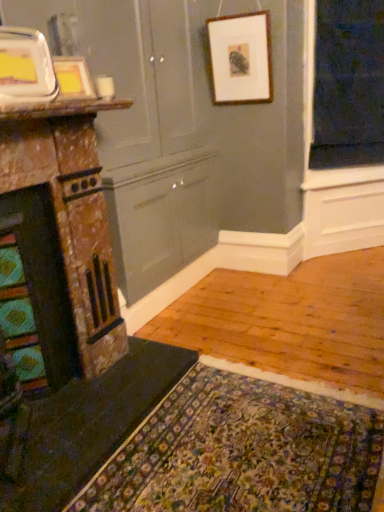
Question: Is the surface of white marble countertop at upper left in direct contact with black fabric at upper right?

Choices:
 (A) yes
 (B) no

Answer: (B)

Question: Does white marble countertop at upper left come in front of black fabric at upper right?

Choices:
 (A) no
 (B) yes

Answer: (B)

Question: Is white marble countertop at upper left smaller than black fabric at upper right?

Choices:
 (A) no
 (B) yes

Answer: (B)

Question: Can you confirm if white marble countertop at upper left is taller than black fabric at upper right?

Choices:
 (A) no
 (B) yes

Answer: (A)

Question: Is white marble countertop at upper left far from black fabric at upper right?

Choices:
 (A) yes
 (B) no

Answer: (A)

Question: Is white marble countertop at upper left positioned beyond the bounds of black fabric at upper right?

Choices:
 (A) no
 (B) yes

Answer: (B)

Question: Is dark green felt doormat at lower left to the left of black fabric at upper right from the viewer's perspective?

Choices:
 (A) no
 (B) yes

Answer: (B)

Question: Is dark green felt doormat at lower left looking in the opposite direction of black fabric at upper right?

Choices:
 (A) yes
 (B) no

Answer: (B)

Question: Considering the relative sizes of dark green felt doormat at lower left and black fabric at upper right in the image provided, is dark green felt doormat at lower left taller than black fabric at upper right?

Choices:
 (A) yes
 (B) no

Answer: (B)

Question: Can you confirm if dark green felt doormat at lower left is bigger than black fabric at upper right?

Choices:
 (A) no
 (B) yes

Answer: (A)

Question: Does dark green felt doormat at lower left touch black fabric at upper right?

Choices:
 (A) yes
 (B) no

Answer: (B)

Question: Is dark green felt doormat at lower left surrounding black fabric at upper right?

Choices:
 (A) no
 (B) yes

Answer: (A)

Question: From a real-world perspective, is dark green felt doormat at lower left under wooden picture frame at upper center, which is the third picture frame in left-to-right order?

Choices:
 (A) no
 (B) yes

Answer: (B)